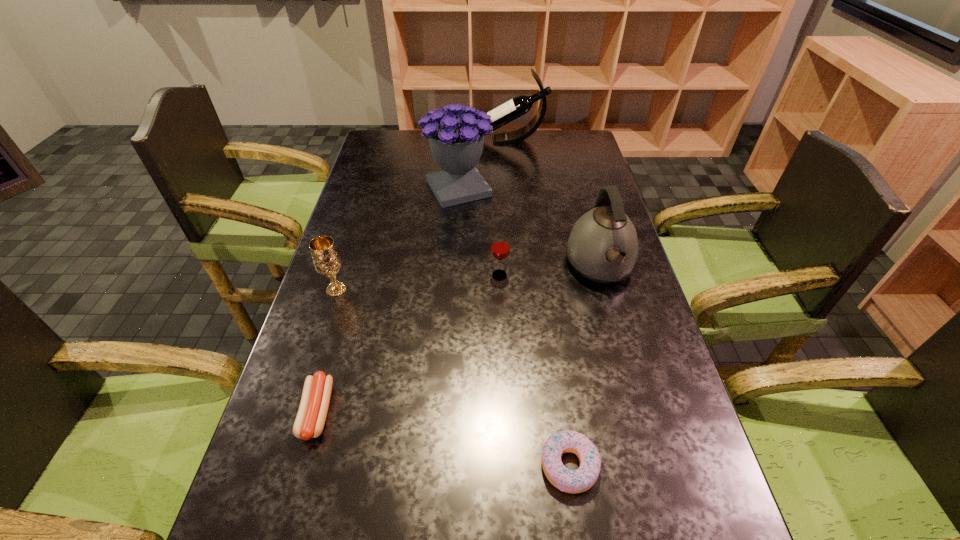
Where is `free location located 0.170m on the stand of the wine bottle`? free location located 0.170m on the stand of the wine bottle is located at coordinates (431, 140).

This screenshot has width=960, height=540. Find the location of `vacant region located 0.180m at the spout of the fifth shortest object`. vacant region located 0.180m at the spout of the fifth shortest object is located at coordinates (626, 361).

The height and width of the screenshot is (540, 960). What are the coordinates of `vacant area situated on the back of the fourth tallest object` in the screenshot? It's located at (349, 247).

Where is `free region located 0.150m on the left of the fifth tallest object`? free region located 0.150m on the left of the fifth tallest object is located at coordinates (436, 275).

Where is `free space located on the back of the doughnut`? This screenshot has height=540, width=960. free space located on the back of the doughnut is located at coordinates (558, 380).

Find the location of `free space located 0.270m on the back of the sausage`. free space located 0.270m on the back of the sausage is located at coordinates (351, 291).

Where is `object at the far edge`? The width and height of the screenshot is (960, 540). object at the far edge is located at coordinates click(x=520, y=105).

Find the location of a particular element. chalice that is at the left edge is located at coordinates (326, 259).

Locate an element on the screen. sausage situated at the left edge is located at coordinates (310, 420).

I want to click on wine bottle present at the right edge, so click(520, 105).